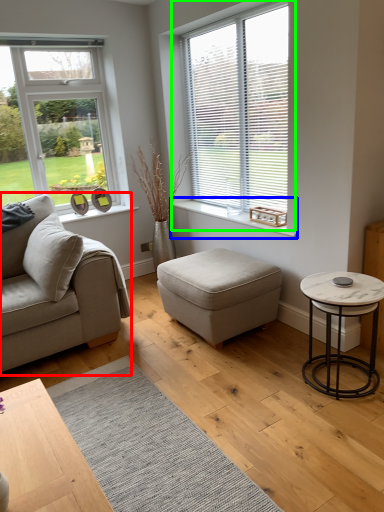
Question: Estimate the real-world distances between objects in this image. Which object is closer to studio couch (highlighted by a red box), window sill (highlighted by a blue box) or window (highlighted by a green box)?

Choices:
 (A) window sill
 (B) window

Answer: (A)